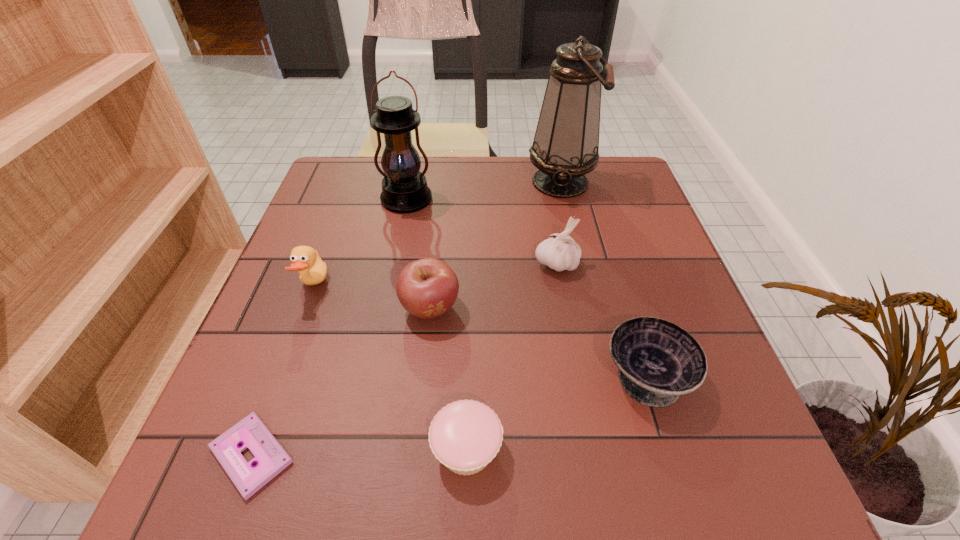
In the image, there is a desktop. Where is `vacant area at the far left corner`? This screenshot has width=960, height=540. vacant area at the far left corner is located at coordinates (366, 158).

The height and width of the screenshot is (540, 960). In the image, there is a desktop. In order to click on free space at the far right corner in this screenshot , I will do `click(591, 176)`.

Image resolution: width=960 pixels, height=540 pixels. I want to click on empty location between the bowl and the duck, so click(480, 331).

The width and height of the screenshot is (960, 540). In order to click on empty space that is in between the duck and the oil lamp in this screenshot , I will do `click(437, 234)`.

Image resolution: width=960 pixels, height=540 pixels. Find the location of `vacant region between the oil lamp and the garlic`. vacant region between the oil lamp and the garlic is located at coordinates (559, 223).

I want to click on vacant space that is in between the lantern and the oil lamp, so click(x=484, y=191).

The width and height of the screenshot is (960, 540). In order to click on vacant space that is in between the oil lamp and the lantern in this screenshot , I will do `click(484, 191)`.

Locate an element on the screen. The height and width of the screenshot is (540, 960). free space between the cupcake and the bowl is located at coordinates (557, 413).

Identify the location of vacant space that's between the lantern and the videotape. This screenshot has width=960, height=540. (329, 328).

Where is `empty space that is in between the apple and the duck`? This screenshot has height=540, width=960. empty space that is in between the apple and the duck is located at coordinates (372, 296).